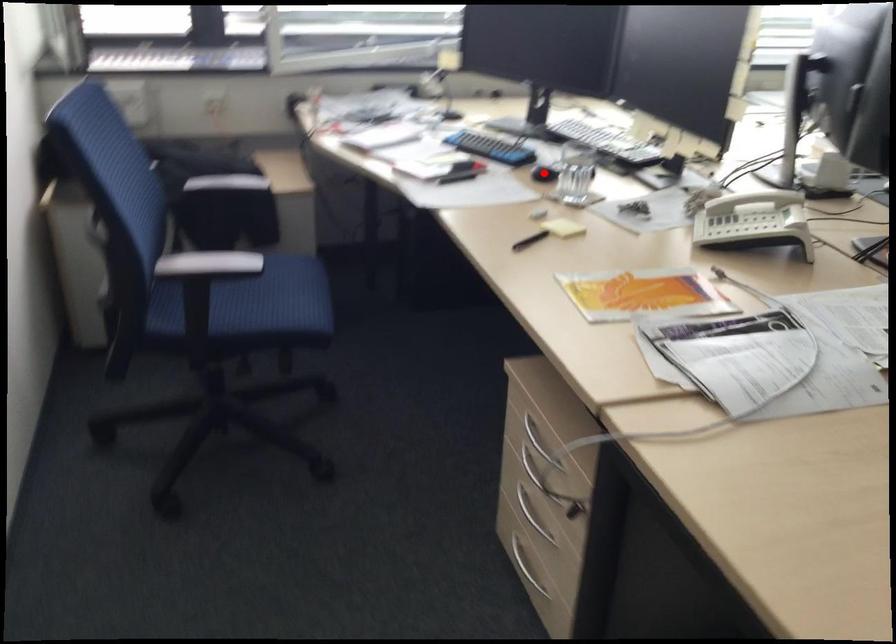
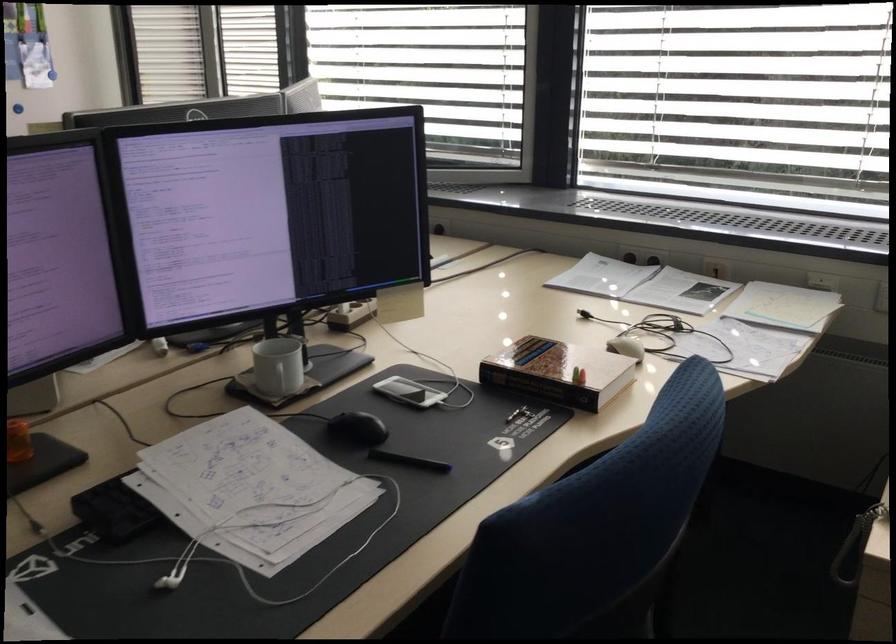
Question: I am providing you with two images of the same scene from different viewpoints. A red point is marked on the first image. At the location where the point appears in image 1, is it still visible in image 2?

Choices:
 (A) Yes
 (B) No

Answer: (B)